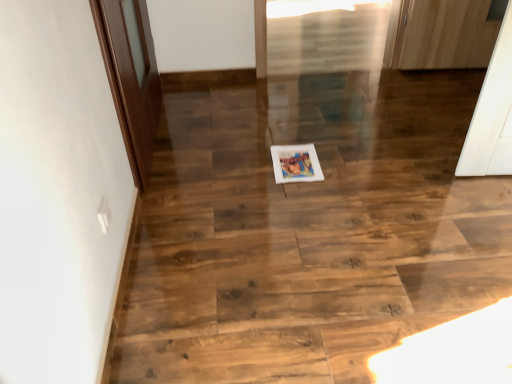
Locate an element on the screen. free spot to the left of matte paper postcard at center is located at coordinates (244, 165).